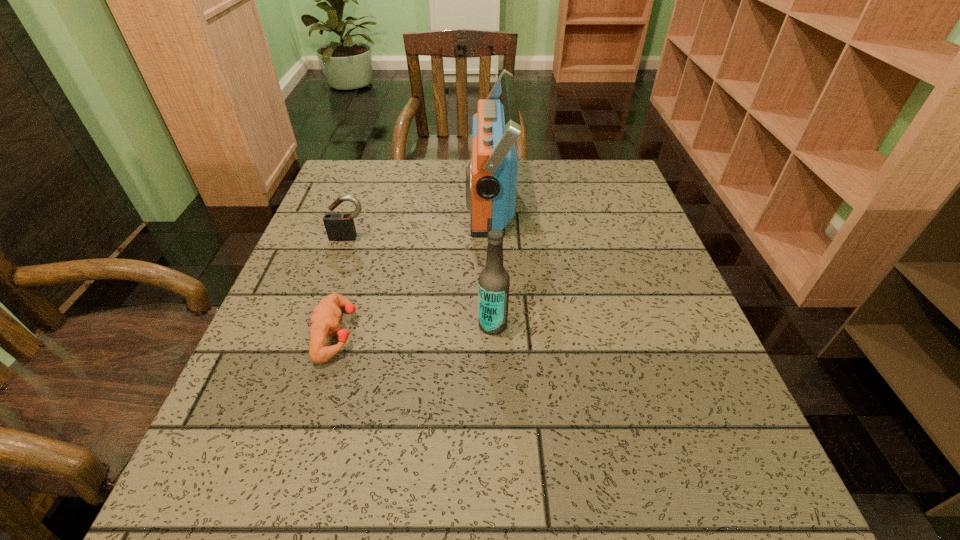
Find the location of `the tallest object`. the tallest object is located at coordinates (491, 177).

Locate an element on the screen. The image size is (960, 540). the second tallest object is located at coordinates (494, 281).

This screenshot has height=540, width=960. I want to click on the second shortest object, so click(x=339, y=226).

The image size is (960, 540). Find the location of `puncher`. puncher is located at coordinates (325, 320).

In order to click on free space located on the front-facing side of the tallest object in this screenshot , I will do `click(358, 201)`.

Where is `vacant space located 0.110m on the front-facing side of the tallest object`? The width and height of the screenshot is (960, 540). vacant space located 0.110m on the front-facing side of the tallest object is located at coordinates (426, 201).

Identify the location of blank space located on the front-facing side of the tallest object. (411, 201).

At what (x,y) coordinates should I click in order to perform the action: click on vacant position located on the label of the third shortest object. Please return your answer as a coordinate pair (x, y). Looking at the image, I should click on (298, 325).

Where is `free space located 0.270m on the label of the third shortest object`? free space located 0.270m on the label of the third shortest object is located at coordinates (339, 325).

Locate an element on the screen. vacant space located on the label of the third shortest object is located at coordinates (443, 325).